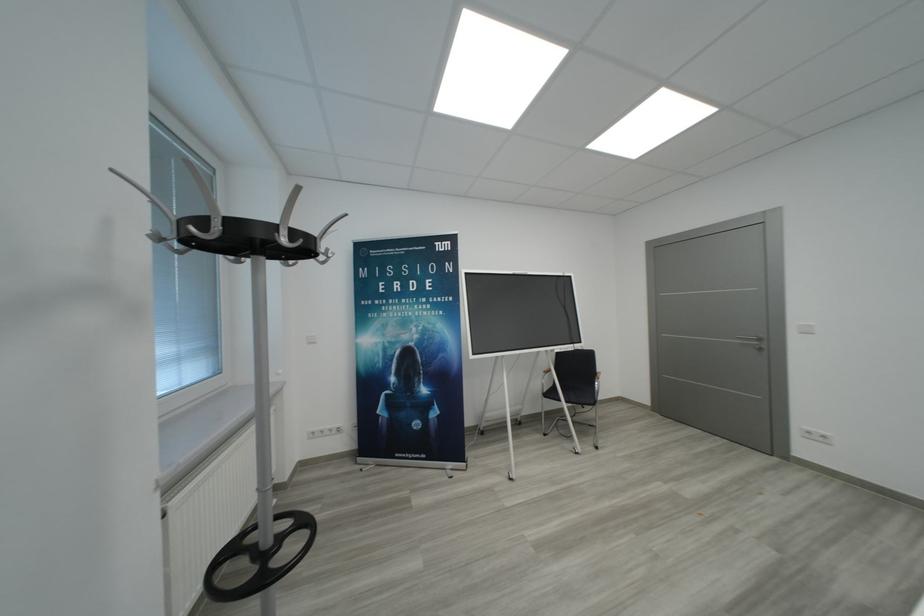
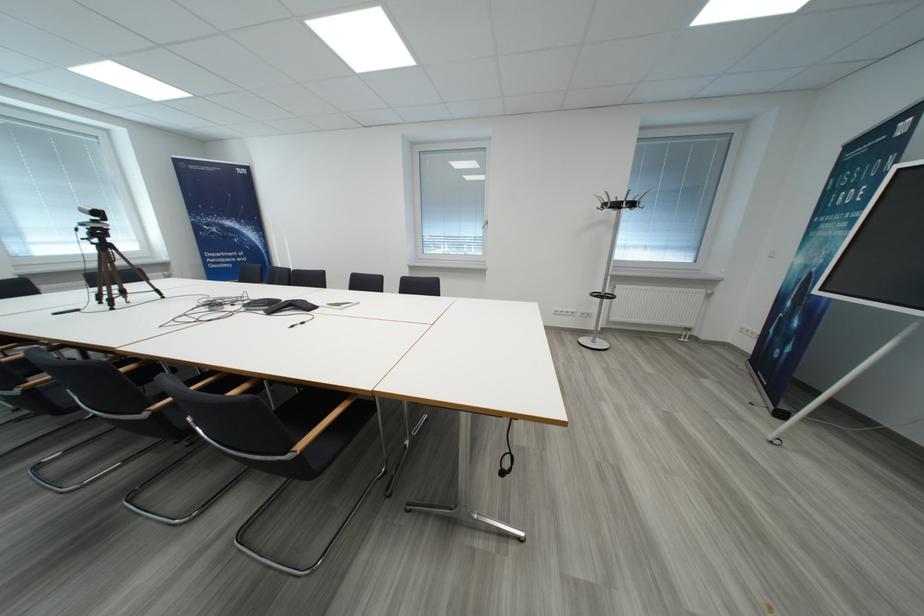
Find the pixel in the second image that matches (378,342) in the first image.

(807, 264)